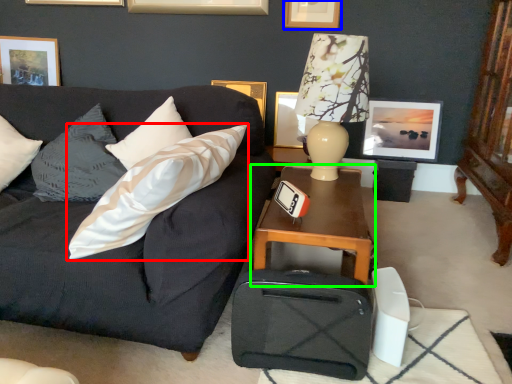
Question: Based on their relative distances, which object is nearer to pillow (highlighted by a red box)? Choose from picture frame (highlighted by a blue box) and table (highlighted by a green box).

Choices:
 (A) picture frame
 (B) table

Answer: (B)